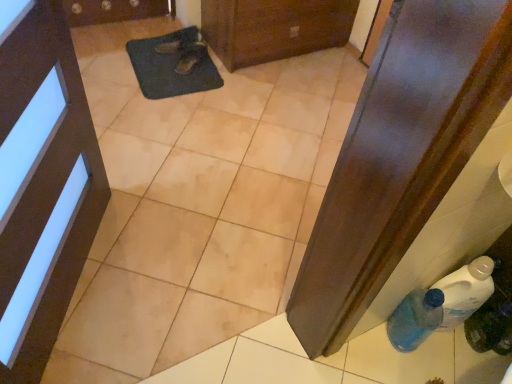
Locate an element on the screen. Image resolution: width=512 pixels, height=384 pixels. free space in front of brown leather shoe at center, acting as the first footwear starting from the bottom is located at coordinates (179, 82).